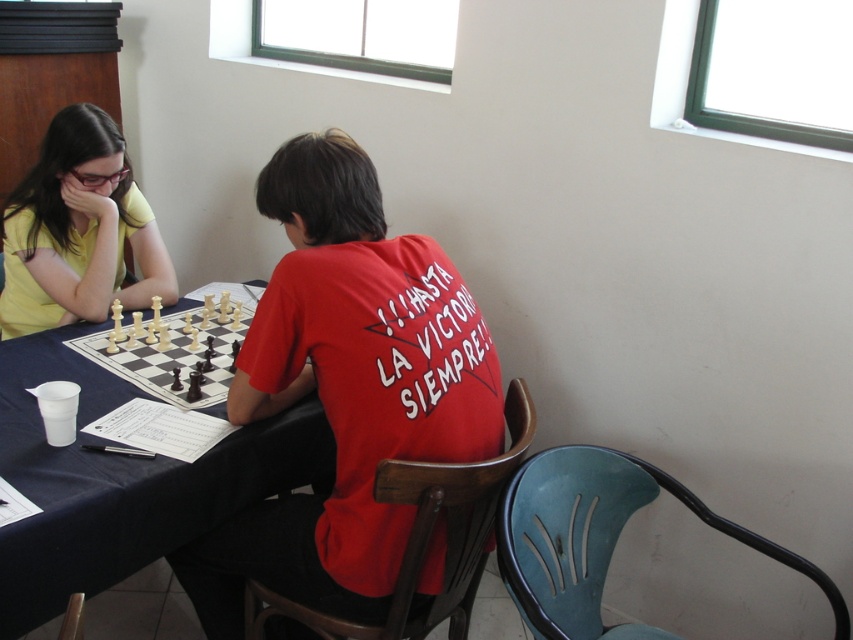
Question: Which point is closer to the camera?

Choices:
 (A) white plastic chess set at center
 (B) blue fabric table at lower left
 (C) matte yellow shirt at left

Answer: (B)

Question: Which point appears farthest from the camera in this image?

Choices:
 (A) (316, 554)
 (B) (103, 195)
 (C) (53, 579)
 (D) (71, 340)

Answer: (B)

Question: Does red matte shirt at center have a greater width compared to blue fabric table at lower left?

Choices:
 (A) no
 (B) yes

Answer: (A)

Question: Considering the relative positions of matte yellow shirt at left and white plastic chess set at center in the image provided, where is matte yellow shirt at left located with respect to white plastic chess set at center?

Choices:
 (A) right
 (B) left

Answer: (B)

Question: Observing the image, what is the correct spatial positioning of matte yellow shirt at left in reference to white plastic chess set at center?

Choices:
 (A) right
 (B) left

Answer: (B)

Question: Which point is farther to the camera?

Choices:
 (A) red matte shirt at center
 (B) blue fabric table at lower left
 (C) white plastic chess set at center
 (D) matte yellow shirt at left

Answer: (D)